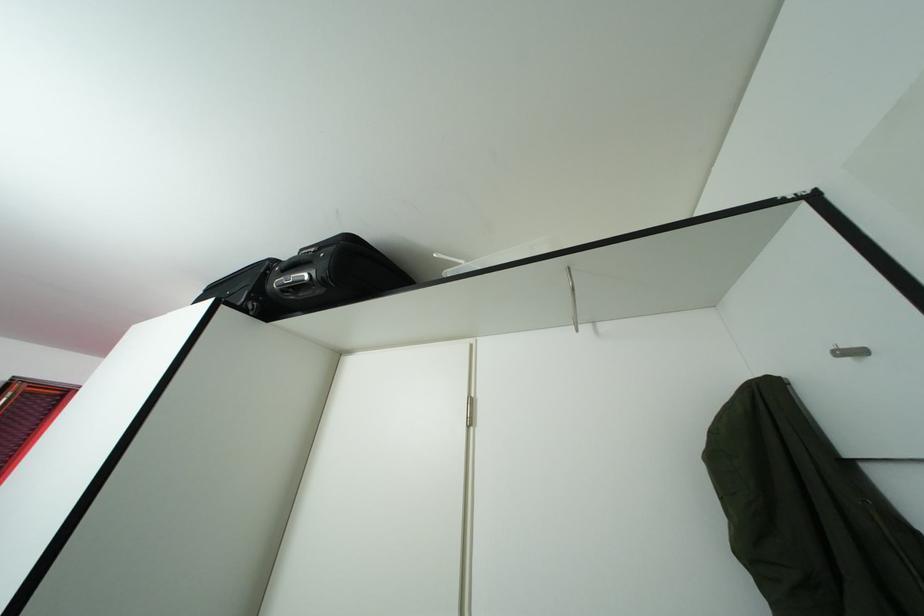
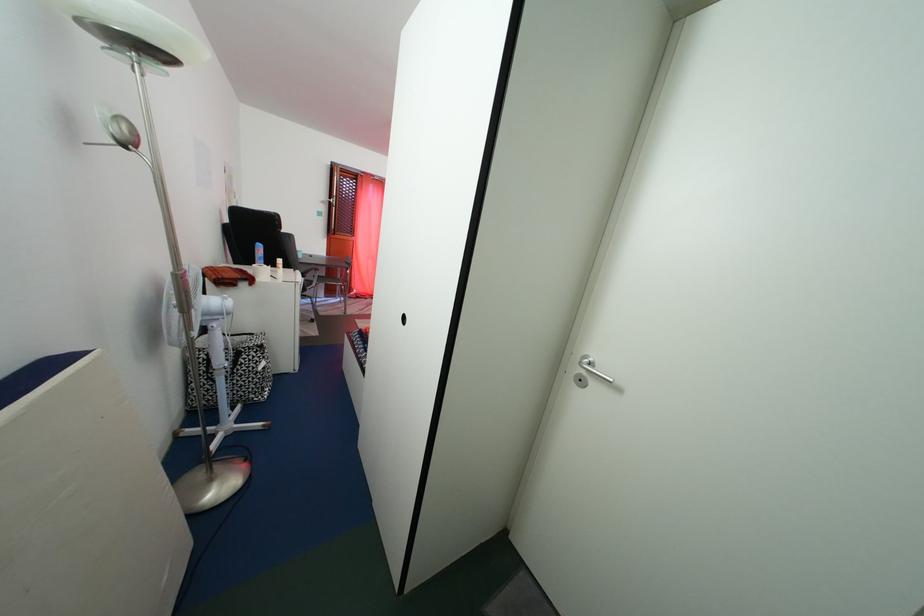
Based on the photo, the first image is from the beginning of the video and the second image is from the end. How did the camera likely rotate when shooting the video?

The camera's rotation is toward left-down.